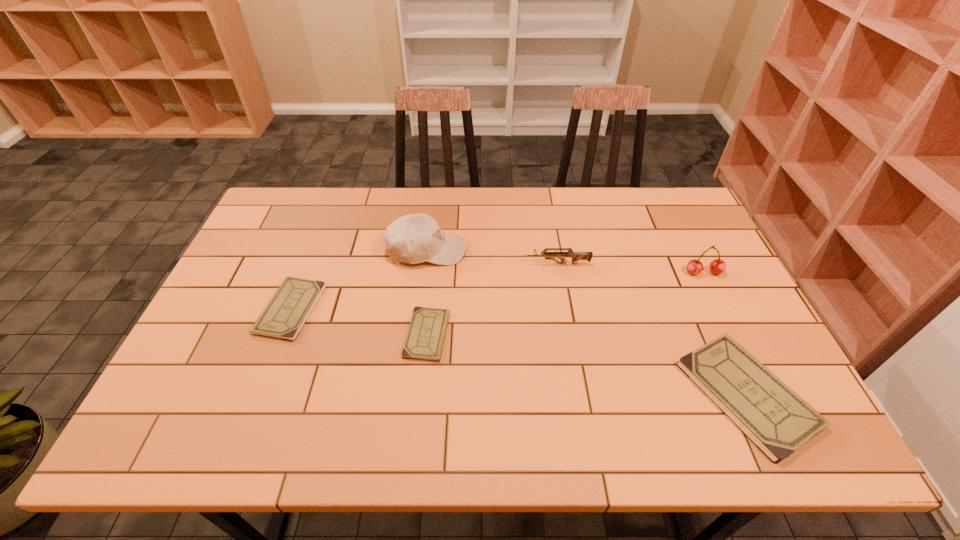
Please determine a free point for an extra checkbook to ensure balance. Please provide its 2D coordinates. Your answer should be formatted as a tuple, i.e. [(x, y)], where the tuple contains the x and y coordinates of a point satisfying the conditions above.

[(578, 362)]